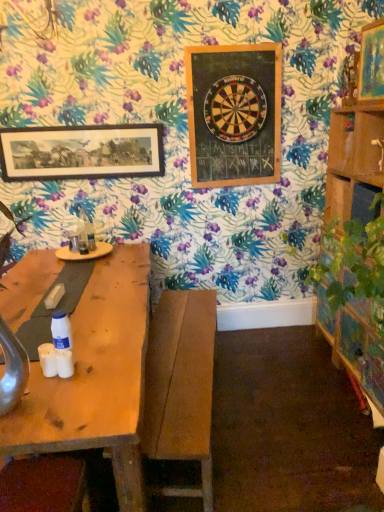
Question: Is the position of wooden framed print at upper left, the 3th picture frame when ordered from front to back, less distant than that of velvet brown cushion at lower left, which appears as the first swivel chair when viewed from the left?

Choices:
 (A) yes
 (B) no

Answer: (B)

Question: Considering the relative sizes of wooden framed print at upper left, the 3th picture frame when ordered from front to back, and velvet brown cushion at lower left, which appears as the first swivel chair when viewed from the left, in the image provided, is wooden framed print at upper left, the 3th picture frame when ordered from front to back, taller than velvet brown cushion at lower left, which appears as the first swivel chair when viewed from the left,?

Choices:
 (A) no
 (B) yes

Answer: (B)

Question: From the image's perspective, is wooden framed print at upper left, marked as the 1th picture frame in a back-to-front arrangement, located beneath velvet brown cushion at lower left, the first swivel chair positioned from the front?

Choices:
 (A) yes
 (B) no

Answer: (B)

Question: Considering the relative sizes of wooden framed print at upper left, the 1th picture frame when ordered from left to right, and velvet brown cushion at lower left, which ranks as the 2th swivel chair in back-to-front order, in the image provided, is wooden framed print at upper left, the 1th picture frame when ordered from left to right, thinner than velvet brown cushion at lower left, which ranks as the 2th swivel chair in back-to-front order,?

Choices:
 (A) no
 (B) yes

Answer: (B)

Question: Is wooden framed print at upper left, which is the third picture frame from right to left, facing towards velvet brown cushion at lower left, which appears as the first swivel chair when viewed from the left?

Choices:
 (A) no
 (B) yes

Answer: (A)

Question: Is wooden framed print at upper left, the 1th picture frame when ordered from left to right, surrounding velvet brown cushion at lower left, the first swivel chair positioned from the front?

Choices:
 (A) no
 (B) yes

Answer: (A)

Question: From the image's perspective, is wooden framed print at upper left, the 1th picture frame when ordered from left to right, located beneath wooden picture frame at upper right, the 3th picture frame when ordered from back to front?

Choices:
 (A) no
 (B) yes

Answer: (B)

Question: Is wooden framed print at upper left, the 3th picture frame when ordered from front to back, turned away from wooden picture frame at upper right, arranged as the 1th picture frame when viewed from the right?

Choices:
 (A) yes
 (B) no

Answer: (B)

Question: From a real-world perspective, is wooden framed print at upper left, marked as the 1th picture frame in a back-to-front arrangement, positioned over wooden picture frame at upper right, arranged as the 1th picture frame when viewed from the right, based on gravity?

Choices:
 (A) yes
 (B) no

Answer: (B)

Question: Is wooden framed print at upper left, the 1th picture frame when ordered from left to right, further to the viewer compared to wooden picture frame at upper right, the 3th picture frame when ordered from back to front?

Choices:
 (A) yes
 (B) no

Answer: (A)

Question: Considering the relative sizes of wooden framed print at upper left, the 1th picture frame when ordered from left to right, and wooden picture frame at upper right, positioned as the first picture frame in front-to-back order, in the image provided, is wooden framed print at upper left, the 1th picture frame when ordered from left to right, thinner than wooden picture frame at upper right, positioned as the first picture frame in front-to-back order,?

Choices:
 (A) yes
 (B) no

Answer: (A)

Question: Is wooden framed print at upper left, the 3th picture frame when ordered from front to back, to the left of wooden picture frame at upper right, the 3th picture frame when ordered from back to front, from the viewer's perspective?

Choices:
 (A) yes
 (B) no

Answer: (A)

Question: From a real-world perspective, is wooden framed print at upper left, the 3th picture frame when ordered from front to back, physically below wooden bench at center, which is the 2th swivel chair in front-to-back order?

Choices:
 (A) no
 (B) yes

Answer: (A)